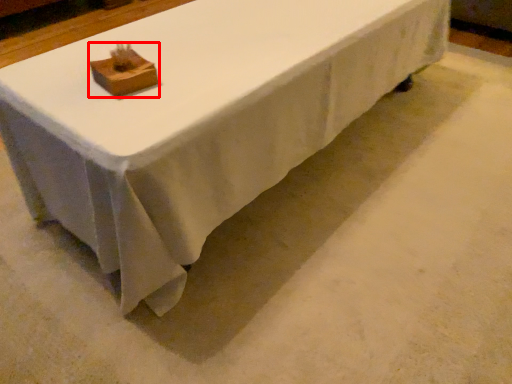
Question: From the image's perspective, what is the correct spatial positioning of block (annotated by the red box) in reference to table?

Choices:
 (A) above
 (B) below

Answer: (B)